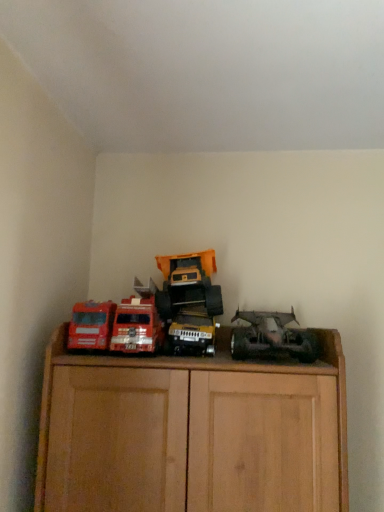
Image resolution: width=384 pixels, height=512 pixels. What do you see at coordinates (272, 338) in the screenshot?
I see `rusty metal truck at right, which appears as the 1th toy when viewed from the right` at bounding box center [272, 338].

Where is `matte red truck at left, which is the 1th toy from left to right`? matte red truck at left, which is the 1th toy from left to right is located at coordinates (91, 325).

The image size is (384, 512). Describe the element at coordinates (137, 326) in the screenshot. I see `metallic red fire truck at left, the third toy when ordered from right to left` at that location.

This screenshot has width=384, height=512. Describe the element at coordinates (192, 332) in the screenshot. I see `metallic yellow truck at center, acting as the 2th toy starting from the right` at that location.

The image size is (384, 512). I want to click on rusty metal truck at right, which appears as the 1th toy when viewed from the right, so click(x=272, y=338).

From a real-world perspective, between metallic red fire truck at left, the third toy when ordered from right to left, and matte red truck at left, the fourth toy viewed from the right, who is vertically lower?

matte red truck at left, the fourth toy viewed from the right.

Considering the relative sizes of metallic red fire truck at left, the third toy when ordered from right to left, and matte red truck at left, which is the 1th toy from left to right, in the image provided, is metallic red fire truck at left, the third toy when ordered from right to left, wider than matte red truck at left, which is the 1th toy from left to right,?

Yes.

Who is more distant, metallic red fire truck at left, the third toy when ordered from right to left, or matte red truck at left, which is the 1th toy from left to right?

Positioned behind is metallic red fire truck at left, the third toy when ordered from right to left.

Is metallic red fire truck at left, the third toy when ordered from right to left, oriented towards matte red truck at left, the fourth toy viewed from the right?

No, metallic red fire truck at left, the third toy when ordered from right to left, is not oriented towards matte red truck at left, the fourth toy viewed from the right.

Is metallic yellow truck at center, the 3th toy in the left-to-right sequence, not within metallic red fire truck at left, the third toy when ordered from right to left?

Yes, metallic yellow truck at center, the 3th toy in the left-to-right sequence, is not within metallic red fire truck at left, the third toy when ordered from right to left.

Is metallic yellow truck at center, the 3th toy in the left-to-right sequence, beside metallic red fire truck at left, the third toy when ordered from right to left?

No, metallic yellow truck at center, the 3th toy in the left-to-right sequence, is not with metallic red fire truck at left, the third toy when ordered from right to left.

Between metallic yellow truck at center, acting as the 2th toy starting from the right, and metallic red fire truck at left, the third toy when ordered from right to left, which one is positioned in front?

Positioned in front is metallic yellow truck at center, acting as the 2th toy starting from the right.

What's the angular difference between metallic red fire truck at left, the 2th toy viewed from the left, and metallic yellow truck at center, acting as the 2th toy starting from the right,'s facing directions?

The angular difference between metallic red fire truck at left, the 2th toy viewed from the left, and metallic yellow truck at center, acting as the 2th toy starting from the right, is 1.37 degrees.

From a real-world perspective, count 3rd toys upward from the metallic yellow truck at center, the 3th toy in the left-to-right sequence, and point to it. Please provide its 2D coordinates.

[(137, 326)]

Is point (158, 329) closer to viewer compared to point (215, 329)?

Yes, it is.

Is metallic red fire truck at left, the 2th toy viewed from the left, beside metallic yellow truck at center, the 3th toy in the left-to-right sequence?

No.

From a real-world perspective, which is physically above, rusty metal truck at right, which appears as the 1th toy when viewed from the right, or metallic yellow truck at center, acting as the 2th toy starting from the right?

rusty metal truck at right, which appears as the 1th toy when viewed from the right, from a real-world perspective.

Based on the photo, can you tell me how much rusty metal truck at right, which appears as the 1th toy when viewed from the right, and metallic yellow truck at center, acting as the 2th toy starting from the right, differ in facing direction?

The facing directions of rusty metal truck at right, which appears as the 1th toy when viewed from the right, and metallic yellow truck at center, acting as the 2th toy starting from the right, are 0.729 degrees apart.

Would you say metallic yellow truck at center, the 3th toy in the left-to-right sequence, is part of rusty metal truck at right, which appears as the 1th toy when viewed from the right,'s contents?

No.

From the image's perspective, which one is positioned lower, rusty metal truck at right, acting as the fourth toy starting from the left, or metallic yellow truck at center, acting as the 2th toy starting from the right?

From the image's view, metallic yellow truck at center, acting as the 2th toy starting from the right, is below.

Is rusty metal truck at right, acting as the fourth toy starting from the left, in contact with matte red truck at left, the fourth toy viewed from the right?

They are not placed beside each other.

From the image's perspective, is rusty metal truck at right, which appears as the 1th toy when viewed from the right, positioned above or below matte red truck at left, the fourth toy viewed from the right?

Clearly, from the image's perspective, rusty metal truck at right, which appears as the 1th toy when viewed from the right, is below matte red truck at left, the fourth toy viewed from the right.

Is rusty metal truck at right, which appears as the 1th toy when viewed from the right, aimed at matte red truck at left, which is the 1th toy from left to right?

No, rusty metal truck at right, which appears as the 1th toy when viewed from the right, is not facing towards matte red truck at left, which is the 1th toy from left to right.

Considering the relative positions of rusty metal truck at right, which appears as the 1th toy when viewed from the right, and matte red truck at left, the fourth toy viewed from the right, in the image provided, is rusty metal truck at right, which appears as the 1th toy when viewed from the right, behind matte red truck at left, the fourth toy viewed from the right,?

No, rusty metal truck at right, which appears as the 1th toy when viewed from the right, is closer to the viewer.

Is matte red truck at left, the fourth toy viewed from the right, to the left of metallic yellow truck at center, acting as the 2th toy starting from the right, from the viewer's perspective?

Yes.

Between point (72, 341) and point (173, 350), which one is positioned in front?

Positioned in front is point (72, 341).

Is matte red truck at left, the fourth toy viewed from the right, situated inside metallic yellow truck at center, the 3th toy in the left-to-right sequence, or outside?

The correct answer is: outside.

Is matte red truck at left, which is the 1th toy from left to right, in front of or behind metallic yellow truck at center, the 3th toy in the left-to-right sequence, in the image?

Visually, matte red truck at left, which is the 1th toy from left to right, is located in front of metallic yellow truck at center, the 3th toy in the left-to-right sequence.

Considering the positions of objects rusty metal truck at right, acting as the fourth toy starting from the left, and metallic red fire truck at left, the third toy when ordered from right to left, in the image provided, who is behind, rusty metal truck at right, acting as the fourth toy starting from the left, or metallic red fire truck at left, the third toy when ordered from right to left,?

metallic red fire truck at left, the third toy when ordered from right to left, is more distant.

I want to click on the 2nd toy above when counting from the rusty metal truck at right, acting as the fourth toy starting from the left (from the image's perspective), so click(137, 326).

Does rusty metal truck at right, which appears as the 1th toy when viewed from the right, have a larger size compared to metallic red fire truck at left, the third toy when ordered from right to left?

Correct, rusty metal truck at right, which appears as the 1th toy when viewed from the right, is larger in size than metallic red fire truck at left, the third toy when ordered from right to left.

Where is `toy lying on the left of metallic red fire truck at left, the 2th toy viewed from the left`? toy lying on the left of metallic red fire truck at left, the 2th toy viewed from the left is located at coordinates (91, 325).

At what (x,y) coordinates should I click in order to perform the action: click on the 3rd toy directly beneath the metallic red fire truck at left, the third toy when ordered from right to left (from a real-world perspective). Please return your answer as a coordinate pair (x, y). Looking at the image, I should click on (192, 332).

When comparing their distances from matte red truck at left, the fourth toy viewed from the right, does metallic red fire truck at left, the third toy when ordered from right to left, or metallic yellow truck at center, the 3th toy in the left-to-right sequence, seem closer?

Among the two, metallic red fire truck at left, the third toy when ordered from right to left, is located nearer to matte red truck at left, the fourth toy viewed from the right.

When comparing their distances from metallic red fire truck at left, the 2th toy viewed from the left, does metallic yellow truck at center, the 3th toy in the left-to-right sequence, or matte red truck at left, the fourth toy viewed from the right, seem closer?

Based on the image, matte red truck at left, the fourth toy viewed from the right, appears to be nearer to metallic red fire truck at left, the 2th toy viewed from the left.

In the scene shown: Estimate the real-world distances between objects in this image. Which object is further from matte red truck at left, which is the 1th toy from left to right, rusty metal truck at right, which appears as the 1th toy when viewed from the right, or metallic yellow truck at center, acting as the 2th toy starting from the right?

rusty metal truck at right, which appears as the 1th toy when viewed from the right, is further to matte red truck at left, which is the 1th toy from left to right.

Which object lies further to the anchor point matte red truck at left, the fourth toy viewed from the right, rusty metal truck at right, acting as the fourth toy starting from the left, or metallic red fire truck at left, the 2th toy viewed from the left?

Among the two, rusty metal truck at right, acting as the fourth toy starting from the left, is located further to matte red truck at left, the fourth toy viewed from the right.

Looking at the image, which one is located closer to rusty metal truck at right, acting as the fourth toy starting from the left, matte red truck at left, the fourth toy viewed from the right, or metallic yellow truck at center, the 3th toy in the left-to-right sequence?

Among the two, metallic yellow truck at center, the 3th toy in the left-to-right sequence, is located nearer to rusty metal truck at right, acting as the fourth toy starting from the left.

When comparing their distances from matte red truck at left, the fourth toy viewed from the right, does metallic yellow truck at center, the 3th toy in the left-to-right sequence, or metallic red fire truck at left, the third toy when ordered from right to left, seem closer?

The object closer to matte red truck at left, the fourth toy viewed from the right, is metallic red fire truck at left, the third toy when ordered from right to left.

Estimate the real-world distances between objects in this image. Which object is further from metallic red fire truck at left, the 2th toy viewed from the left, matte red truck at left, the fourth toy viewed from the right, or rusty metal truck at right, acting as the fourth toy starting from the left?

rusty metal truck at right, acting as the fourth toy starting from the left, is positioned further to the anchor metallic red fire truck at left, the 2th toy viewed from the left.

Based on their spatial positions, is metallic yellow truck at center, the 3th toy in the left-to-right sequence, or metallic red fire truck at left, the third toy when ordered from right to left, further from rusty metal truck at right, acting as the fourth toy starting from the left?

Among the two, metallic red fire truck at left, the third toy when ordered from right to left, is located further to rusty metal truck at right, acting as the fourth toy starting from the left.

Where is `toy between metallic red fire truck at left, the third toy when ordered from right to left, and rusty metal truck at right, acting as the fourth toy starting from the left`? The image size is (384, 512). toy between metallic red fire truck at left, the third toy when ordered from right to left, and rusty metal truck at right, acting as the fourth toy starting from the left is located at coordinates (192, 332).

Where is `toy between matte red truck at left, the fourth toy viewed from the right, and metallic yellow truck at center, acting as the 2th toy starting from the right`? The height and width of the screenshot is (512, 384). toy between matte red truck at left, the fourth toy viewed from the right, and metallic yellow truck at center, acting as the 2th toy starting from the right is located at coordinates (137, 326).